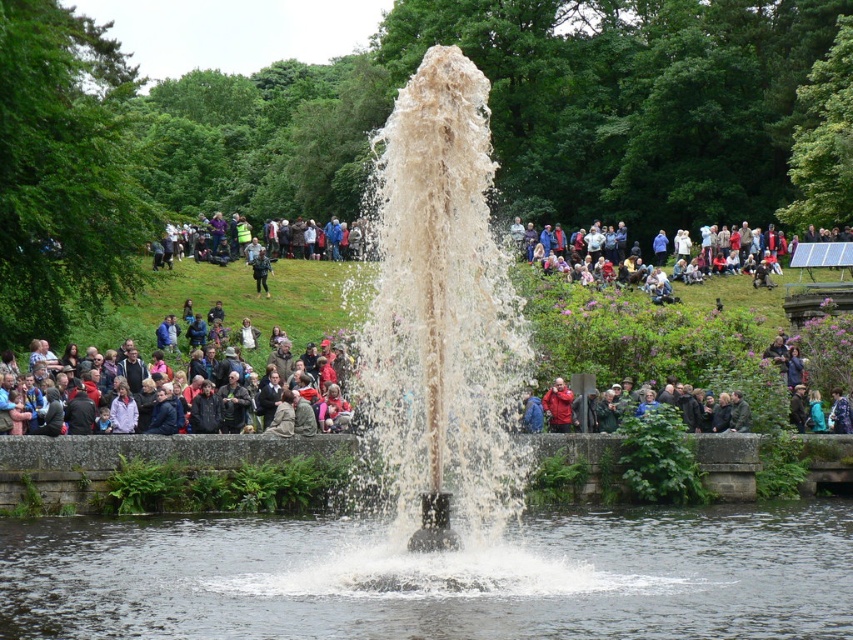
Who is taller, clear water at center or matte black jacket at center?

Standing taller between the two is matte black jacket at center.

Is clear water at center to the right of matte black jacket at center from the viewer's perspective?

Yes, clear water at center is to the right of matte black jacket at center.

What do you see at coordinates (434, 577) in the screenshot? The width and height of the screenshot is (853, 640). I see `clear water at center` at bounding box center [434, 577].

I want to click on clear water at center, so click(434, 577).

Between clear water at center and red fabric jacket at center, which one is positioned higher?

red fabric jacket at center

What do you see at coordinates (434, 577) in the screenshot?
I see `clear water at center` at bounding box center [434, 577].

Is point (740, 531) positioned after point (554, 388)?

That is False.

Locate an element on the screen. clear water at center is located at coordinates (434, 577).

Which is below, white frothy water at center or matte black jacket at center?

Positioned lower is matte black jacket at center.

From the picture: Can you confirm if white frothy water at center is smaller than matte black jacket at center?

No, white frothy water at center is not smaller than matte black jacket at center.

Is point (402, 522) less distant than point (697, 353)?

Yes, it is in front of point (697, 353).

The width and height of the screenshot is (853, 640). I want to click on white frothy water at center, so click(438, 346).